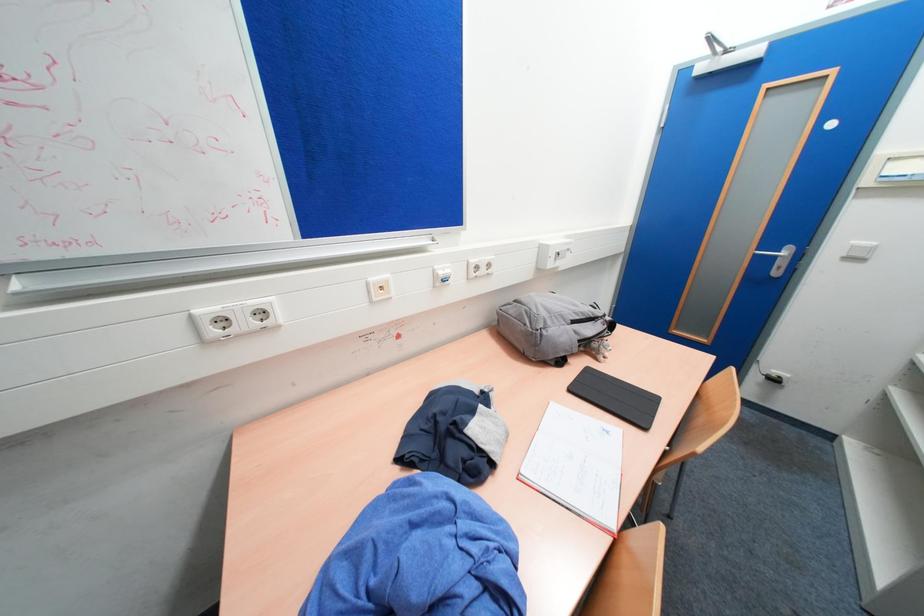
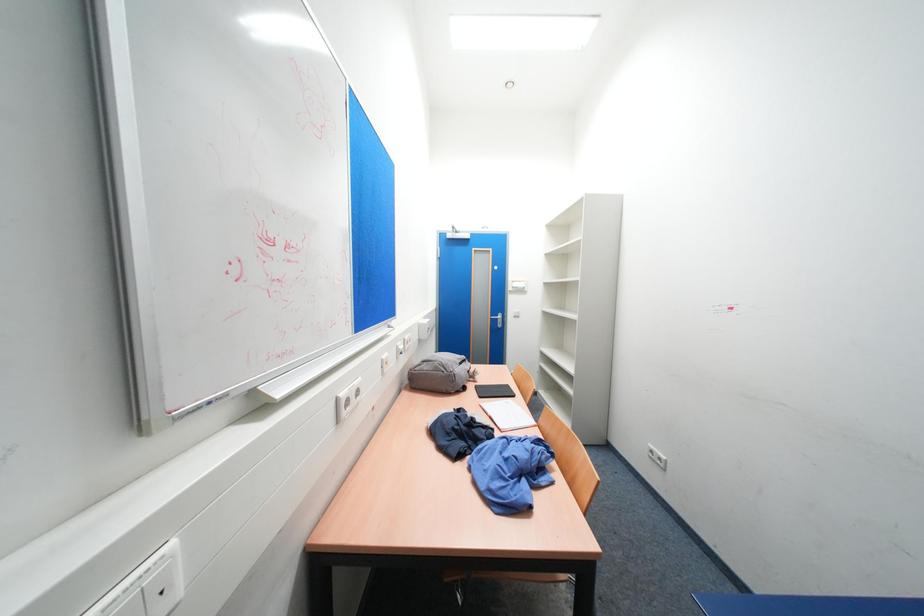
Question: How did the camera likely rotate?

Choices:
 (A) Left
 (B) Right
 (C) Up
 (D) Down

Answer: (B)